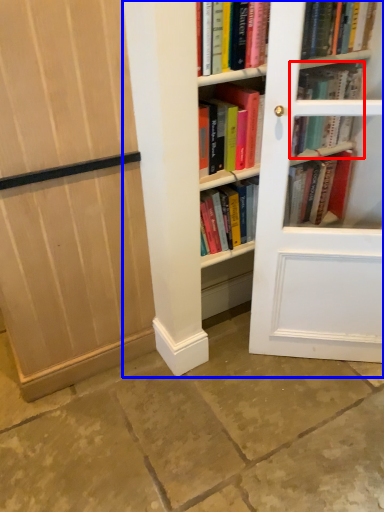
Question: Which of the following is the closest to the observer, book (highlighted by a red box) or bookcase (highlighted by a blue box)?

Choices:
 (A) book
 (B) bookcase

Answer: (B)